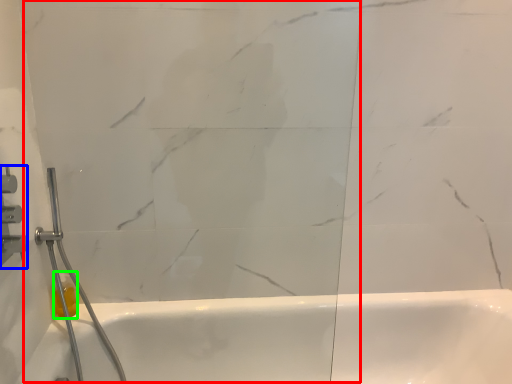
Question: Which is nearer to the glass door (highlighted by a red box)? shower (highlighted by a blue box) or toiletry (highlighted by a green box).

Choices:
 (A) shower
 (B) toiletry

Answer: (A)